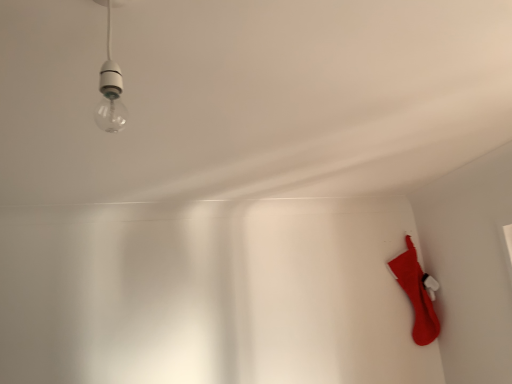
Question: Is clear glass bulb at upper left beside red fabric stocking at lower right?

Choices:
 (A) yes
 (B) no

Answer: (B)

Question: Is clear glass bulb at upper left behind red fabric stocking at lower right?

Choices:
 (A) no
 (B) yes

Answer: (A)

Question: Can you confirm if clear glass bulb at upper left is thinner than red fabric stocking at lower right?

Choices:
 (A) no
 (B) yes

Answer: (B)

Question: From a real-world perspective, is clear glass bulb at upper left on red fabric stocking at lower right?

Choices:
 (A) no
 (B) yes

Answer: (B)

Question: Can you confirm if clear glass bulb at upper left is bigger than red fabric stocking at lower right?

Choices:
 (A) no
 (B) yes

Answer: (A)

Question: Considering the relative sizes of clear glass bulb at upper left and red fabric stocking at lower right in the image provided, is clear glass bulb at upper left shorter than red fabric stocking at lower right?

Choices:
 (A) yes
 (B) no

Answer: (A)

Question: Does red fabric stocking at lower right have a larger size compared to clear glass bulb at upper left?

Choices:
 (A) no
 (B) yes

Answer: (B)

Question: From a real-world perspective, does red fabric stocking at lower right stand above clear glass bulb at upper left?

Choices:
 (A) yes
 (B) no

Answer: (B)

Question: Is clear glass bulb at upper left inside red fabric stocking at lower right?

Choices:
 (A) no
 (B) yes

Answer: (A)

Question: Considering the relative sizes of red fabric stocking at lower right and clear glass bulb at upper left in the image provided, is red fabric stocking at lower right taller than clear glass bulb at upper left?

Choices:
 (A) no
 (B) yes

Answer: (B)

Question: Can you see red fabric stocking at lower right touching clear glass bulb at upper left?

Choices:
 (A) no
 (B) yes

Answer: (A)

Question: From the image's perspective, is red fabric stocking at lower right below clear glass bulb at upper left?

Choices:
 (A) no
 (B) yes

Answer: (B)

Question: Is clear glass bulb at upper left wider or thinner than red fabric stocking at lower right?

Choices:
 (A) thin
 (B) wide

Answer: (A)